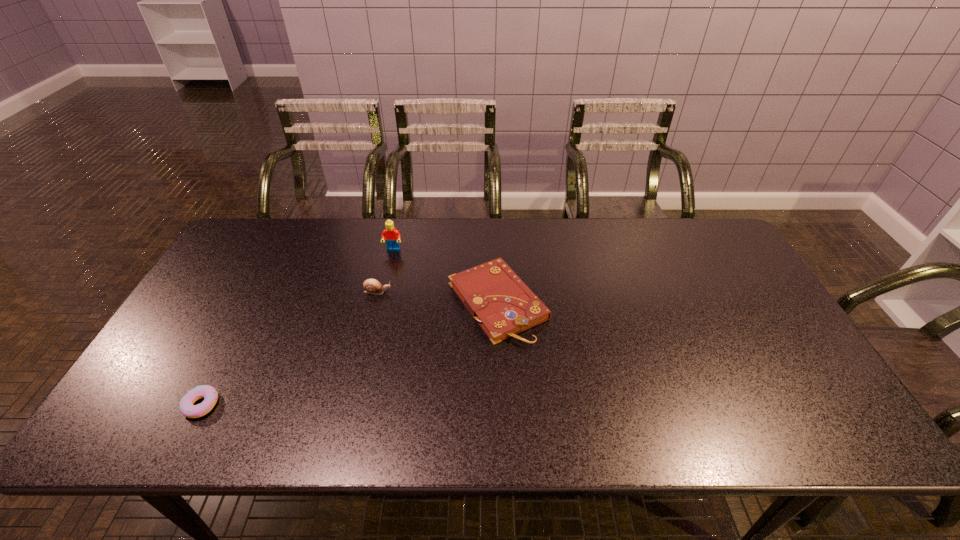
At what (x,y) coordinates should I click in order to perform the action: click on Lego. Please return your answer as a coordinate pair (x, y). The image size is (960, 540). Looking at the image, I should click on [x=392, y=236].

Locate an element on the screen. The width and height of the screenshot is (960, 540). the tallest object is located at coordinates (392, 236).

The width and height of the screenshot is (960, 540). Identify the location of escargot. (372, 286).

At what (x,y) coordinates should I click in order to perform the action: click on notebook. Please return your answer as a coordinate pair (x, y). Looking at the image, I should click on (502, 304).

The height and width of the screenshot is (540, 960). What are the coordinates of `the shortest object` in the screenshot? It's located at (209, 393).

This screenshot has width=960, height=540. I want to click on the leftmost object, so [209, 393].

Where is `vacant area situated on the face of the Lego`? The image size is (960, 540). vacant area situated on the face of the Lego is located at coordinates (386, 281).

What are the coordinates of `free space located 0.190m on the front-facing side of the escargot` in the screenshot? It's located at (456, 292).

You are a GUI agent. You are given a task and a screenshot of the screen. Output one action in this format:
    pyautogui.click(x=<x>, y=<y>)
    Task: Click on the vacant space located on the left of the notebook
    This screenshot has width=960, height=540.
    Given the screenshot: What is the action you would take?
    pyautogui.click(x=398, y=302)

Locate an element on the screen. This screenshot has height=540, width=960. free space located on the back of the nearest object is located at coordinates (237, 334).